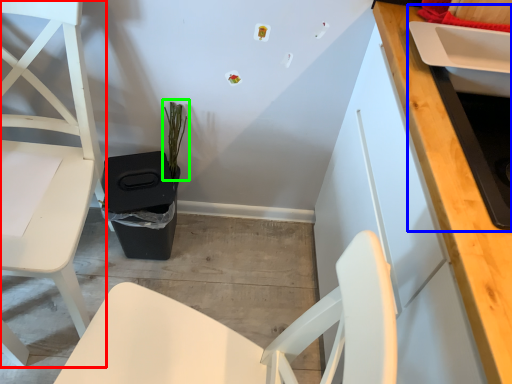
Question: Which object is positioned farthest from chair (highlighted by a red box)? Select from sink (highlighted by a blue box) and plant (highlighted by a green box).

Choices:
 (A) sink
 (B) plant

Answer: (A)